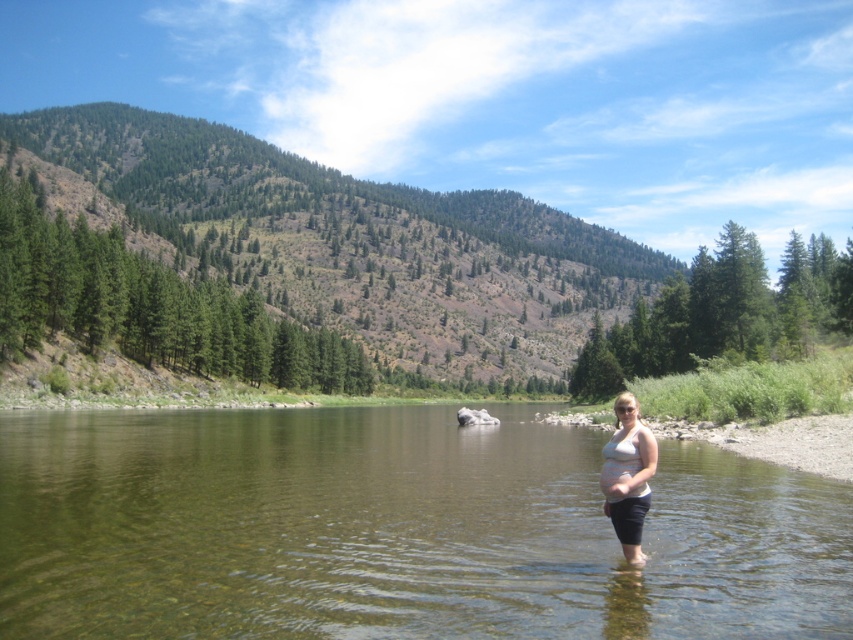
Is point (68, 636) positioned behind point (630, 394)?

No.

Between clear water at center and white matte tank top at center, which one has less height?

clear water at center

I want to click on clear water at center, so click(397, 531).

Who is positioned more to the left, clear water at center or matte skin belly at center?

clear water at center is more to the left.

Between clear water at center and matte skin belly at center, which one has less height?

Standing shorter between the two is matte skin belly at center.

The image size is (853, 640). I want to click on clear water at center, so click(x=397, y=531).

Who is more forward, (635, 449) or (622, 497)?

Result: Point (622, 497) is more forward.

Does white matte tank top at center have a lesser height compared to matte skin belly at center?

In fact, white matte tank top at center may be taller than matte skin belly at center.

Is point (619, 476) closer to camera compared to point (637, 490)?

No.

This screenshot has width=853, height=640. In order to click on white matte tank top at center in this screenshot , I will do `click(628, 476)`.